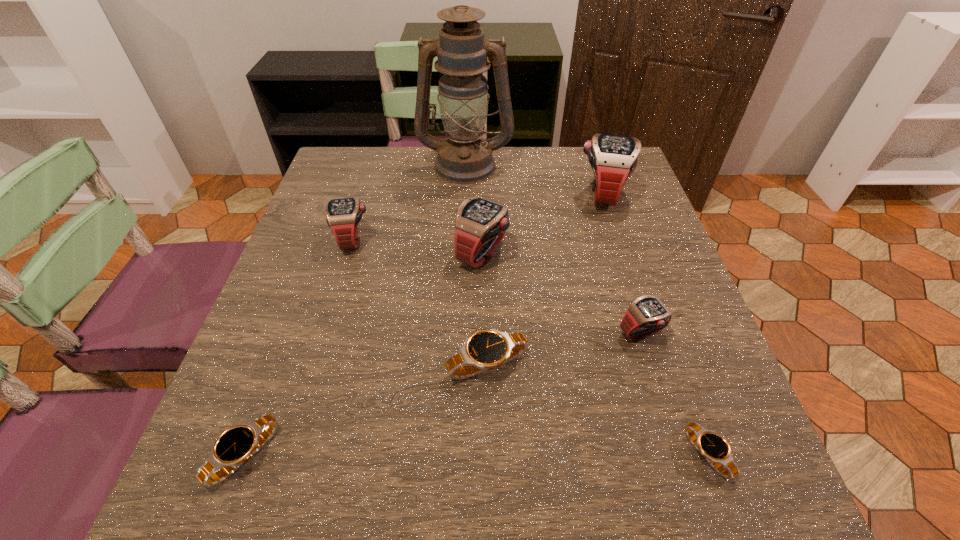
This screenshot has height=540, width=960. What are the coordinates of `brown oil lamp` in the screenshot? It's located at (464, 157).

Find the location of `oil lamp`. oil lamp is located at coordinates click(x=464, y=157).

The width and height of the screenshot is (960, 540). I want to click on the biggest red watch, so click(613, 158).

Image resolution: width=960 pixels, height=540 pixels. I want to click on the farthest watch, so click(x=613, y=158).

This screenshot has height=540, width=960. What are the coordinates of `the second biggest red watch` in the screenshot? It's located at (480, 224).

I want to click on the third tallest object, so click(x=480, y=224).

Where is `the third tallest watch`? This screenshot has height=540, width=960. the third tallest watch is located at coordinates (343, 215).

Where is `the leftmost red watch`? The image size is (960, 540). the leftmost red watch is located at coordinates (343, 215).

Find the location of a particular element. the smallest red watch is located at coordinates coord(647,315).

In order to click on the nearest red watch in this screenshot , I will do `click(647, 315)`.